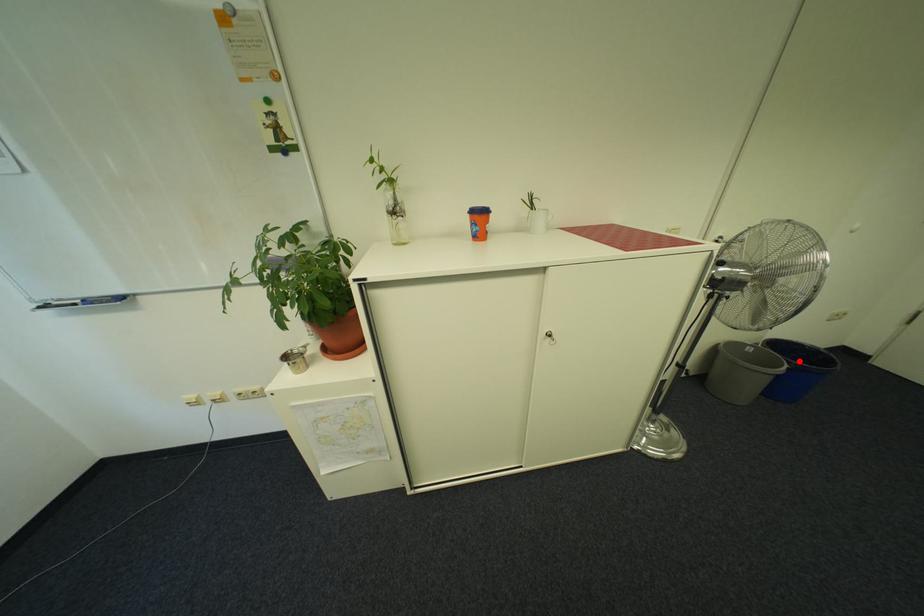
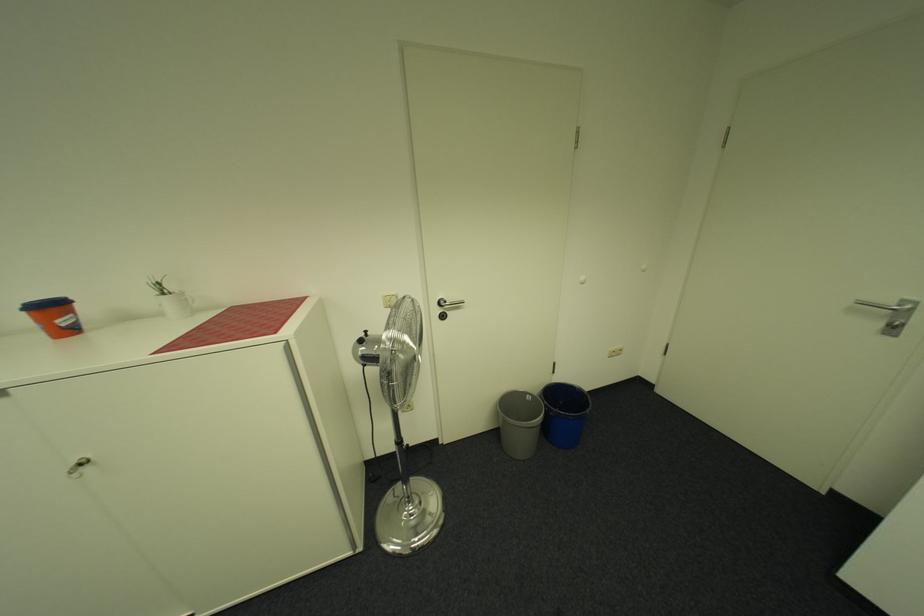
The point at the highlighted location is marked in the first image. Where is the corresponding point in the second image?

(562, 408)